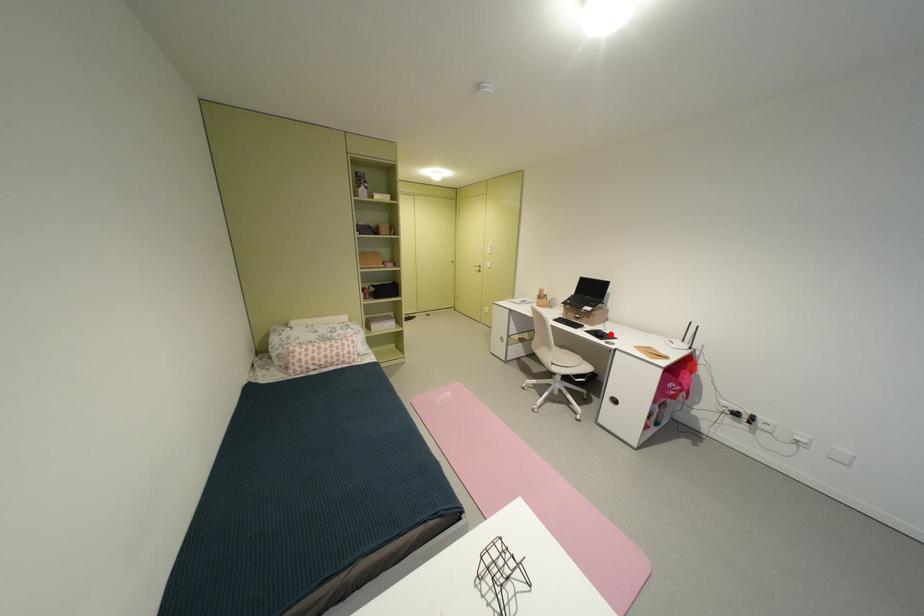
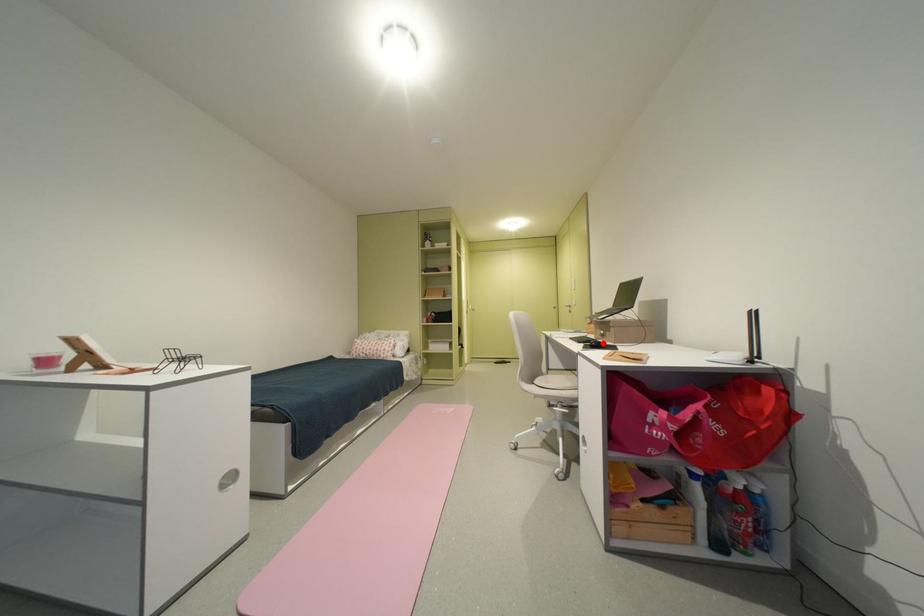
I am providing you with two images of the same scene from different viewpoints. A red point is marked on the first image and another point is marked on the second image. Is the marked point in image1 the same physical position as the marked point in image2?

Yes